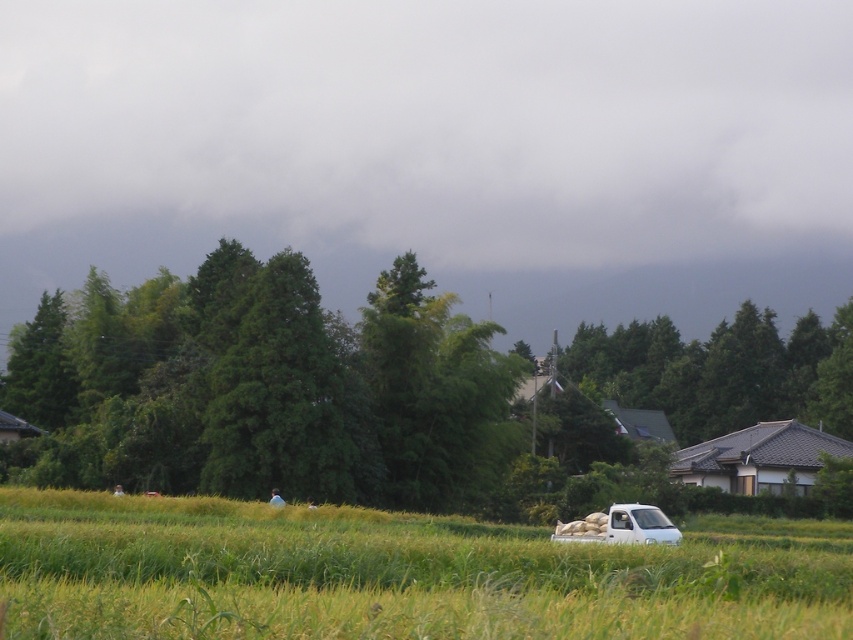
Question: Which of these objects is positioned farthest from the green leafy tree at center?

Choices:
 (A) brown tiled roof at right
 (B) yellow-green grass at lower center

Answer: (B)

Question: Among these points, which one is farthest from the camera?

Choices:
 (A) (428, 584)
 (B) (726, 472)

Answer: (B)

Question: Can you confirm if yellow-green grass at lower center is bigger than brown tiled roof at right?

Choices:
 (A) no
 (B) yes

Answer: (B)

Question: Does yellow-green grass at lower center come in front of brown tiled roof at right?

Choices:
 (A) yes
 (B) no

Answer: (A)

Question: In this image, where is yellow-green grass at lower center located relative to brown tiled roof at right?

Choices:
 (A) above
 (B) below

Answer: (A)

Question: Which point is farther to the camera?

Choices:
 (A) brown tiled roof at right
 (B) green leafy tree at center
 (C) yellow-green grass at lower center

Answer: (B)